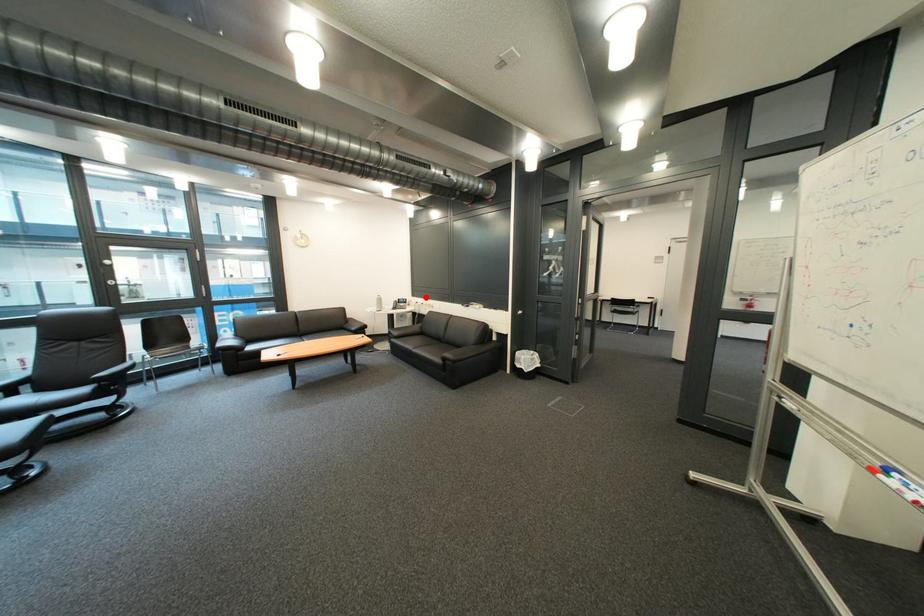
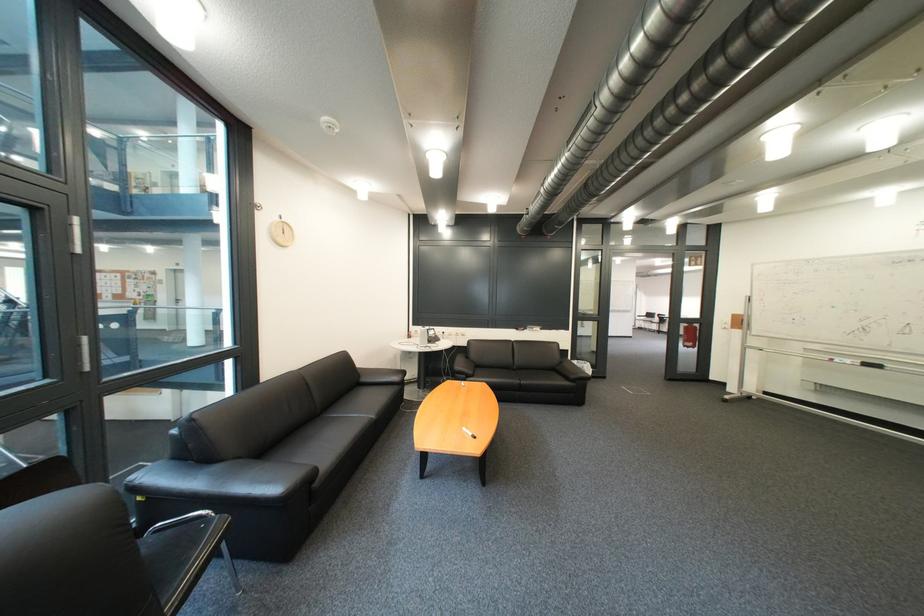
Where in the second image is the point corresponding to the highlighted location from the first image?

(428, 326)